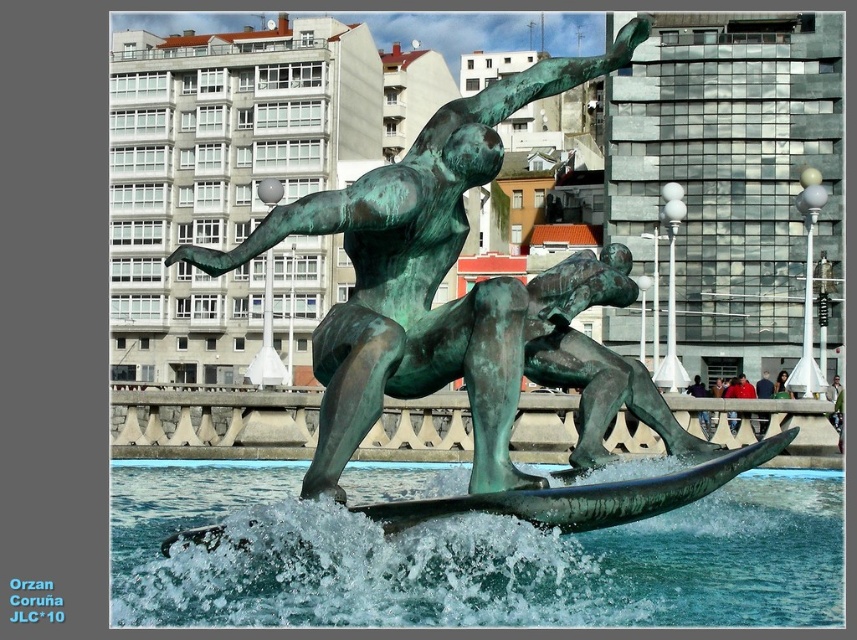
You are an art student analyzing the sculpture in the public square. You observe the green patina bronze statue at center and the green patina surfboard at center. Which object has a greater width?

The green patina bronze statue at center might be wider than green patina surfboard at center according to the description provided.

You are a photographer trying to capture the best angle of the green patina bronze statue at center and the green patina surfboard at center. Based on their positions, which object should you focus on first if you want to include both in your shot without moving your camera?

The green patina bronze statue at center is above the green patina surfboard at center. Therefore, to include both in your shot without moving your camera, you should focus on the green patina bronze statue at center first as it is higher up, allowing the surfboard to naturally fall into the frame below.